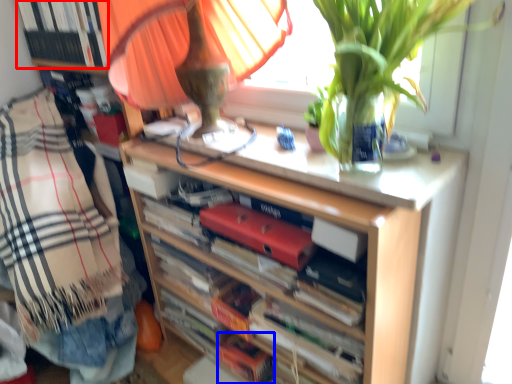
Question: Among these objects, which one is farthest to the camera, book (highlighted by a red box) or book (highlighted by a blue box)?

Choices:
 (A) book
 (B) book

Answer: (B)